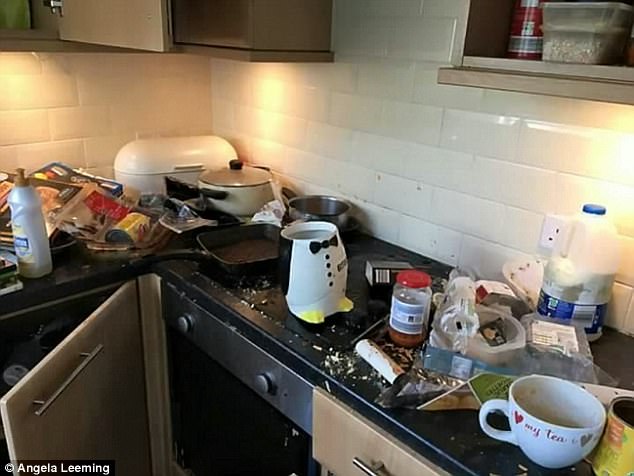
At what (x,y) coordinates should I click in order to perform the action: click on tile backsplash. Please return your answer as a coordinate pair (x, y). The image size is (634, 476). Looking at the image, I should click on (466, 186).